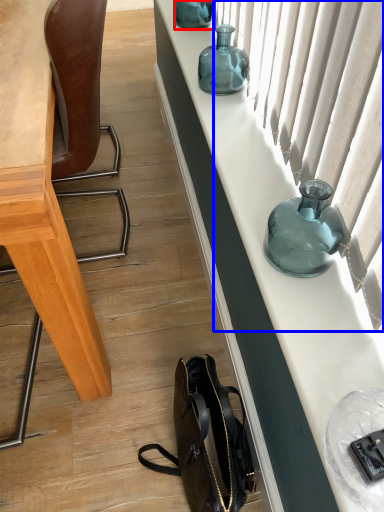
Question: Which object is further to the camera taking this photo, bottle (highlighted by a red box) or curtain (highlighted by a blue box)?

Choices:
 (A) bottle
 (B) curtain

Answer: (A)